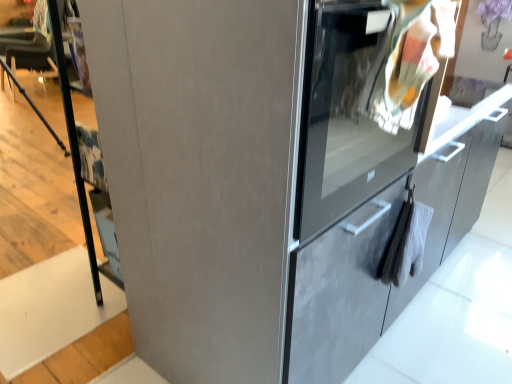
Question: Which is correct: white matte stair at lower left is inside satin gray cabinet at right, or outside of it?

Choices:
 (A) outside
 (B) inside

Answer: (A)

Question: Is point (5, 349) closer or farther from the camera than point (463, 168)?

Choices:
 (A) closer
 (B) farther

Answer: (A)

Question: Considering the real-world distances, which object is farthest from the satin gray oven at right?

Choices:
 (A) satin gray cabinet at right
 (B) white matte stair at lower left

Answer: (B)

Question: Estimate the real-world distances between objects in this image. Which object is farther from the satin gray cabinet at right?

Choices:
 (A) white matte stair at lower left
 (B) satin gray oven at right

Answer: (A)